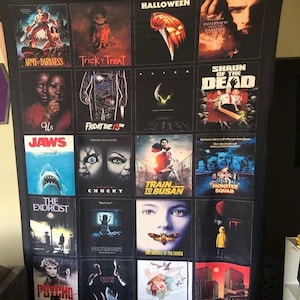
In order to click on movie posters in this screenshot , I will do `click(164, 123)`.